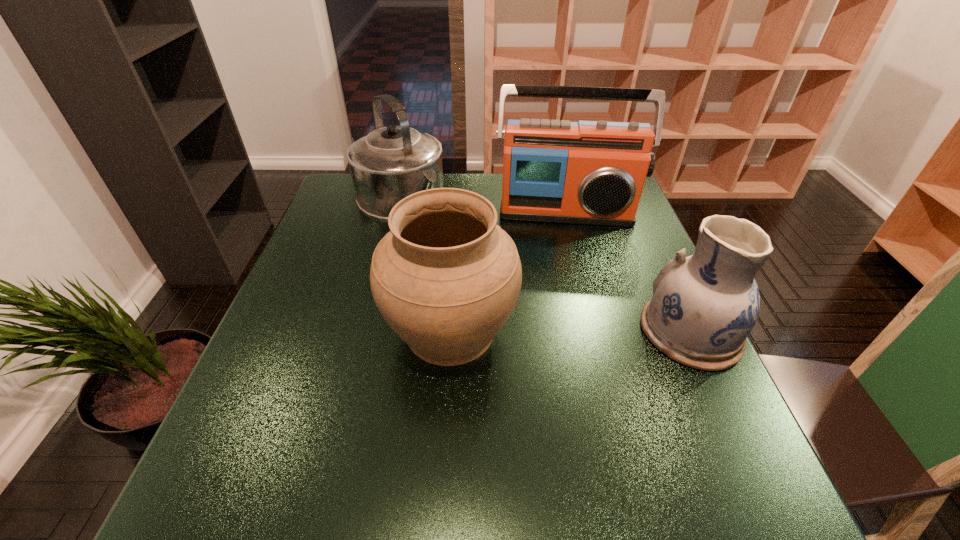
Find the location of `vacant spot on the desktop that is between the urn and the pottery and is positioned with the spout at the front of the kettle`. vacant spot on the desktop that is between the urn and the pottery and is positioned with the spout at the front of the kettle is located at coordinates (540, 331).

Find the location of a particular element. Image resolution: width=960 pixels, height=540 pixels. free space on the desktop that is between the urn and the pottery and is positioned on the front-facing side of the radio receiver is located at coordinates (573, 331).